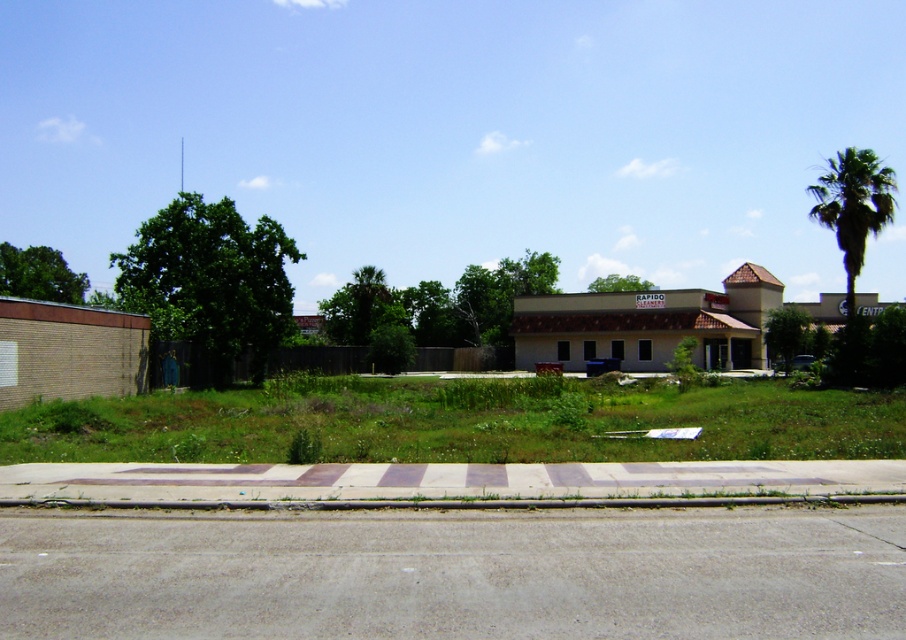
You are standing at the entrance of the building and want to place a new trash can on the grassy lot. The city regulations state that no objects can be placed within 1 meter of any tree. Given the green leafy tree at left is at coordinates point 0.441, 0.233, can you safely place the trash can at your current position?

The green leafy tree at left is located at point (210, 282). Since you are standing at the entrance of the building, which is centrally located, the distance from the tree to your position must be calculated. If the distance is more than 1 meter, placement is allowed. However, without exact coordinates for the entrance, we cannot confirm compliance with the 1 meter rule. Please verify the exact distance using a measuring tool.

You are standing on the sidewalk in front of the building and want to take a photo that includes both the green leafy palm tree at right and the green leafy tree at upper left. Which tree should you position to your left side in the frame to include both?

To include both the green leafy palm tree at right and the green leafy tree at upper left in the photo, position the green leafy palm tree at right to your left side in the frame since it is on the right side of the green leafy tree at upper left.

You are standing on the sidewalk in front of the building and want to walk to the entrance. Which tree, the green leafy tree at left or the green leafy tree at upper center, would you pass closer to?

The green leafy tree at left is positioned over the green leafy tree at upper center, so you would pass closer to the green leafy tree at left.